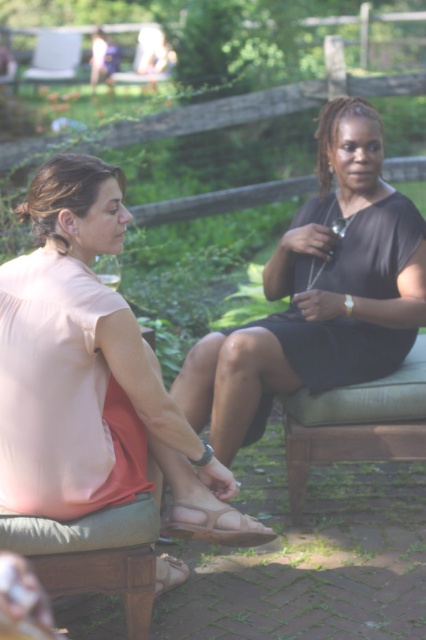
Question: Which point is closer to the camera?

Choices:
 (A) (408, 448)
 (B) (362, 161)
 (C) (54, 477)

Answer: (C)

Question: Does pink fabric blouse at left have a smaller size compared to green fabric bench at center?

Choices:
 (A) no
 (B) yes

Answer: (A)

Question: Does matte black dress at center appear on the right side of green fabric bench at center?

Choices:
 (A) yes
 (B) no

Answer: (B)

Question: Is pink fabric blouse at left closer to the viewer compared to matte black dress at center?

Choices:
 (A) yes
 (B) no

Answer: (A)

Question: Which object is closer to the camera taking this photo?

Choices:
 (A) green fabric bench at center
 (B) matte black dress at center

Answer: (B)

Question: Which of the following is the closest to the observer?

Choices:
 (A) pink fabric blouse at left
 (B) matte black dress at center

Answer: (A)